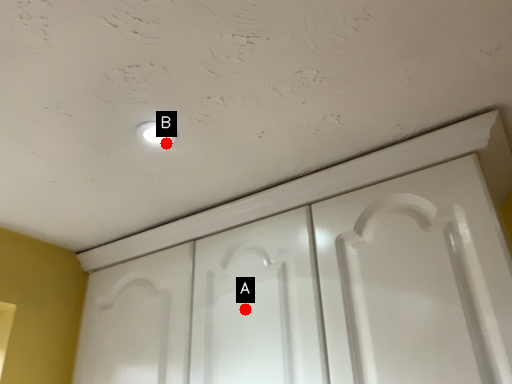
Question: Two points are circled on the image, labeled by A and B beside each circle. Among these points, which one is nearest to the camera?

Choices:
 (A) A is closer
 (B) B is closer

Answer: (B)